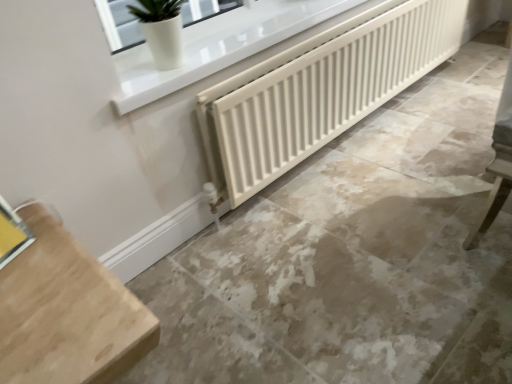
Question: Is yellow cardboard at lower left, which is counted as the first window, starting from the left, not close to white matte radiator at center?

Choices:
 (A) yes
 (B) no

Answer: (A)

Question: Does yellow cardboard at lower left, the 1th window when ordered from front to back, have a smaller size compared to white matte radiator at center?

Choices:
 (A) yes
 (B) no

Answer: (A)

Question: Does yellow cardboard at lower left, the 2th window when ordered from right to left, appear on the right side of white matte radiator at center?

Choices:
 (A) yes
 (B) no

Answer: (B)

Question: From the image's perspective, is yellow cardboard at lower left, which is the first window in bottom-to-top order, under white matte radiator at center?

Choices:
 (A) no
 (B) yes

Answer: (B)

Question: Is the position of yellow cardboard at lower left, the 2th window viewed from the top, less distant than that of white matte radiator at center?

Choices:
 (A) yes
 (B) no

Answer: (A)

Question: Could you tell me if yellow cardboard at lower left, the second window viewed from the back, is turned towards white matte radiator at center?

Choices:
 (A) no
 (B) yes

Answer: (A)

Question: From the image's perspective, does yellow cardboard at lower left, which is the first window in bottom-to-top order, appear lower than light wood table at lower left?

Choices:
 (A) yes
 (B) no

Answer: (B)

Question: Would you say yellow cardboard at lower left, which is the first window in bottom-to-top order, is outside light wood table at lower left?

Choices:
 (A) yes
 (B) no

Answer: (A)

Question: Considering the relative positions of yellow cardboard at lower left, which is the first window in bottom-to-top order, and light wood table at lower left in the image provided, is yellow cardboard at lower left, which is the first window in bottom-to-top order, to the left of light wood table at lower left from the viewer's perspective?

Choices:
 (A) no
 (B) yes

Answer: (B)

Question: Is yellow cardboard at lower left, the 2th window viewed from the top, bigger than light wood table at lower left?

Choices:
 (A) yes
 (B) no

Answer: (B)

Question: Is yellow cardboard at lower left, the 2th window viewed from the top, to the right of light wood table at lower left from the viewer's perspective?

Choices:
 (A) yes
 (B) no

Answer: (B)

Question: Is yellow cardboard at lower left, the second window viewed from the back, facing towards light wood table at lower left?

Choices:
 (A) no
 (B) yes

Answer: (A)

Question: Can we say beige marble floor at center lies outside white matte radiator at center?

Choices:
 (A) yes
 (B) no

Answer: (A)